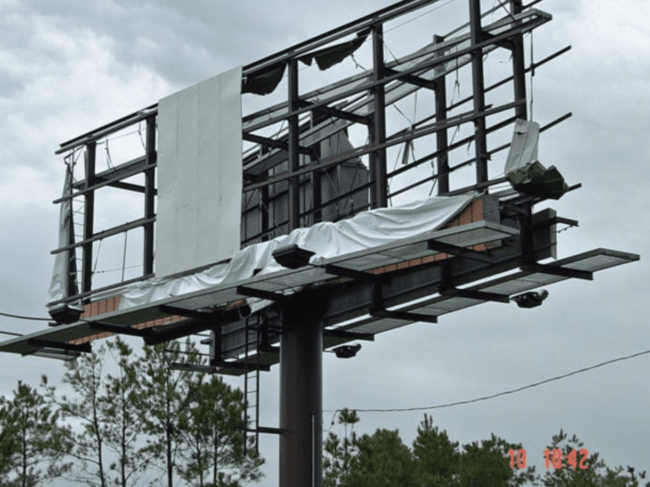
Find the location of a particular element. The image size is (650, 487). hanging cloth is located at coordinates (x=67, y=222).